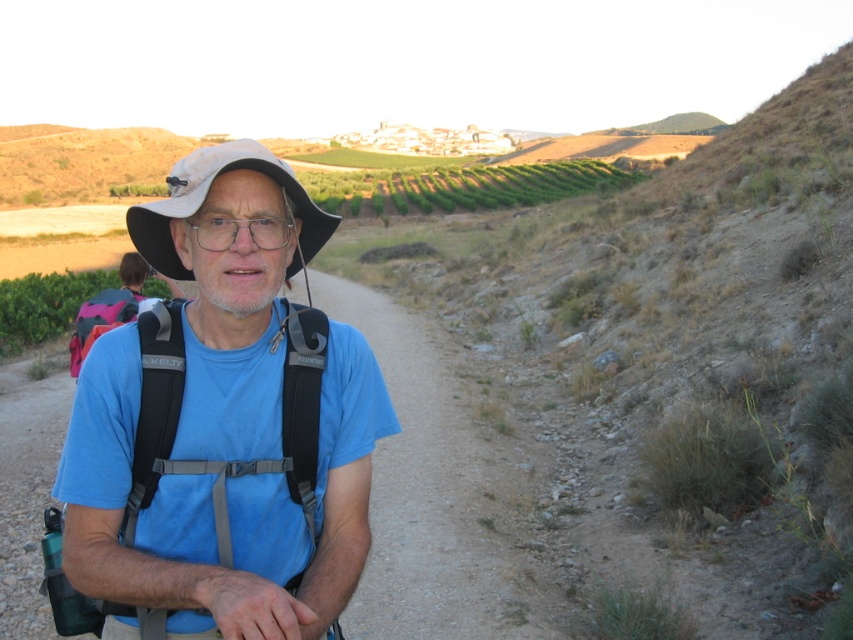
Can you confirm if blue fabric shirt at center is thinner than transparent plastic glasses at center?

No, blue fabric shirt at center is not thinner than transparent plastic glasses at center.

Describe the element at coordinates (223, 429) in the screenshot. The height and width of the screenshot is (640, 853). I see `blue fabric shirt at center` at that location.

Between point (213, 333) and point (289, 220), which one is positioned behind?

Point (213, 333)

Where is `blue fabric shirt at center`? Image resolution: width=853 pixels, height=640 pixels. blue fabric shirt at center is located at coordinates (223, 429).

Is the position of white fabric hat at center more distant than that of transparent plastic glasses at center?

Yes, white fabric hat at center is further from the viewer.

Is white fabric hat at center below transparent plastic glasses at center?

No.

Is point (314, 241) behind point (265, 225)?

Yes.

You are a GUI agent. You are given a task and a screenshot of the screen. Output one action in this format:
    pyautogui.click(x=<x>, y=<y>)
    Task: Click on the white fabric hat at center
    This screenshot has height=640, width=853.
    Given the screenshot: What is the action you would take?
    pyautogui.click(x=206, y=196)

Can you confirm if blue fabric shirt at center is positioned below white fabric hat at center?

Yes.

Which is more to the left, blue fabric shirt at center or white fabric hat at center?

From the viewer's perspective, blue fabric shirt at center appears more on the left side.

The height and width of the screenshot is (640, 853). In order to click on blue fabric shirt at center in this screenshot , I will do `click(223, 429)`.

Image resolution: width=853 pixels, height=640 pixels. I want to click on blue fabric shirt at center, so click(x=223, y=429).